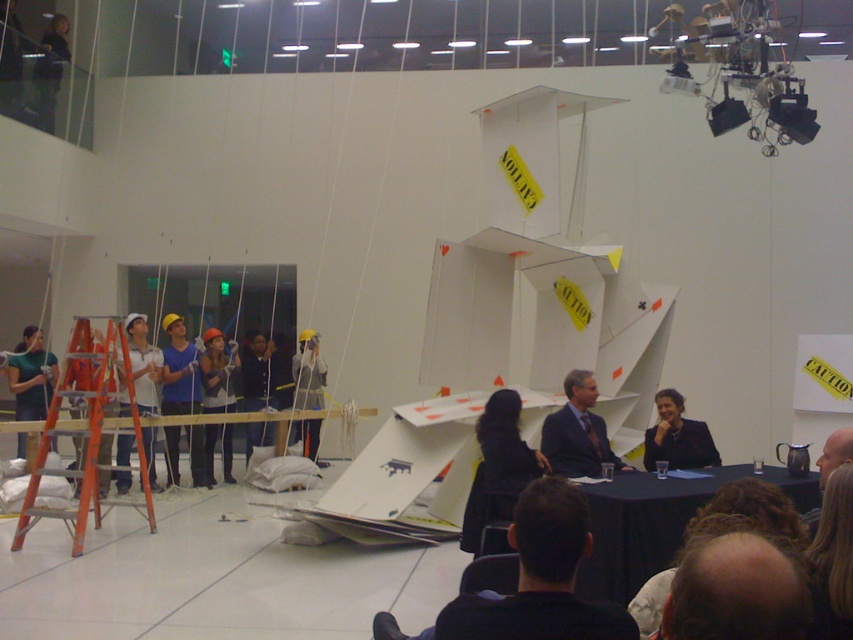
Question: Considering the relative positions of black fabric chair at lower center and blonde hair at lower right in the image provided, where is black fabric chair at lower center located with respect to blonde hair at lower right?

Choices:
 (A) right
 (B) left

Answer: (B)

Question: Which object is positioned closest to the matte black jacket at center?

Choices:
 (A) blue fabric at center
 (B) black suit at center

Answer: (A)

Question: Which of these objects is positioned closest to the black fabric chair at lower center?

Choices:
 (A) smooth bald head at lower right
 (B) blue fabric at center
 (C) black suit at center
 (D) hard hat at center

Answer: (A)

Question: Is dark blue suit at center positioned at the back of black suit at center?

Choices:
 (A) no
 (B) yes

Answer: (A)

Question: Can you confirm if orange metallic ladder at left is positioned to the right of blonde hair at lower right?

Choices:
 (A) yes
 (B) no

Answer: (B)

Question: Which of the following is the closest to the observer?

Choices:
 (A) (831, 468)
 (B) (173, 481)
 (C) (213, 449)
 (D) (480, 420)

Answer: (A)